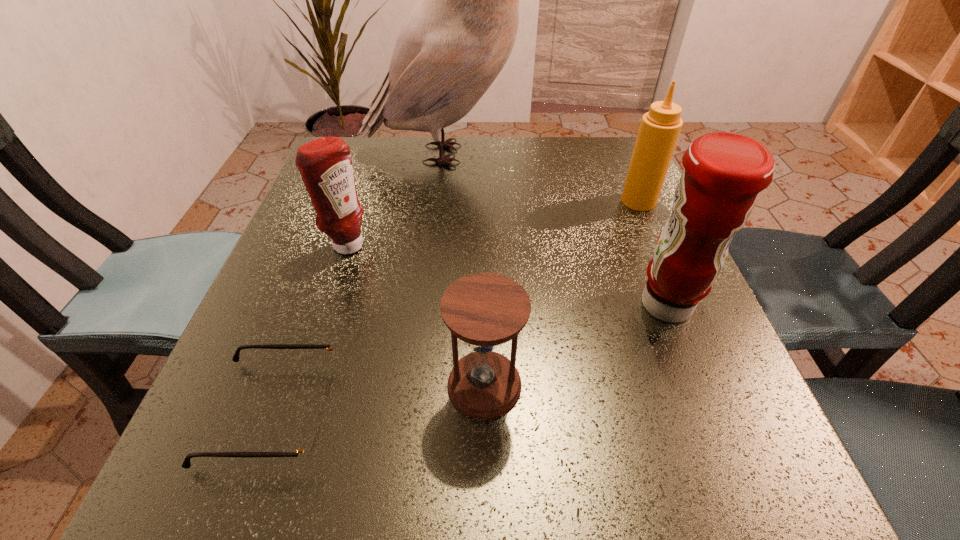
Where is `free space between the leftmost condiment and the fourth farthest object`? free space between the leftmost condiment and the fourth farthest object is located at coordinates (506, 275).

You are a GUI agent. You are given a task and a screenshot of the screen. Output one action in this format:
    pyautogui.click(x=<x>, y=<y>)
    Task: Click on the free space between the farthest condiment and the shortest condiment
    The image size is (960, 540).
    Given the screenshot: What is the action you would take?
    pyautogui.click(x=492, y=223)

Locate an element on the screen. The width and height of the screenshot is (960, 540). free area in between the fourth tallest object and the fifth tallest object is located at coordinates (416, 315).

The image size is (960, 540). Find the location of `blank region between the shortest condiment and the shortest object`. blank region between the shortest condiment and the shortest object is located at coordinates (310, 329).

At what (x,y) coordinates should I click in order to perform the action: click on object that stands as the fourth closest to the third nearest object. Please return your answer as a coordinate pair (x, y). Looking at the image, I should click on (308, 446).

Select which object is the fourth closest to the hourglass. Please provide its 2D coordinates. Your answer should be formatted as a tuple, i.e. [(x, y)], where the tuple contains the x and y coordinates of a point satisfying the conditions above.

[(659, 130)]

Find the location of a particular element. This screenshot has height=540, width=960. condiment that is the second nearest to the spectacles is located at coordinates (723, 173).

The height and width of the screenshot is (540, 960). What are the coordinates of `condiment that is the third closest one to the spectacles` in the screenshot? It's located at (659, 130).

Find the location of a particular element. vacant area in the image that satisfies the following two spatial constraints: 1. on the face of the parakeet; 2. on the back side of the fifth tallest object is located at coordinates (426, 385).

Identify the location of vacant position in the image that satisfies the following two spatial constraints: 1. on the front side of the second nearest condiment; 2. at the hinge ends of the spectacles. The height and width of the screenshot is (540, 960). (291, 413).